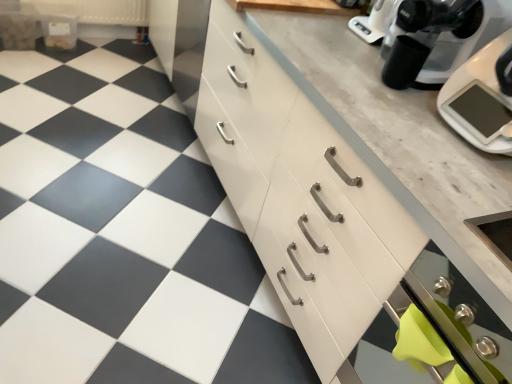
Locate an element on the screen. This screenshot has width=512, height=384. free space to the left of black plastic coffee maker at upper right is located at coordinates (340, 65).